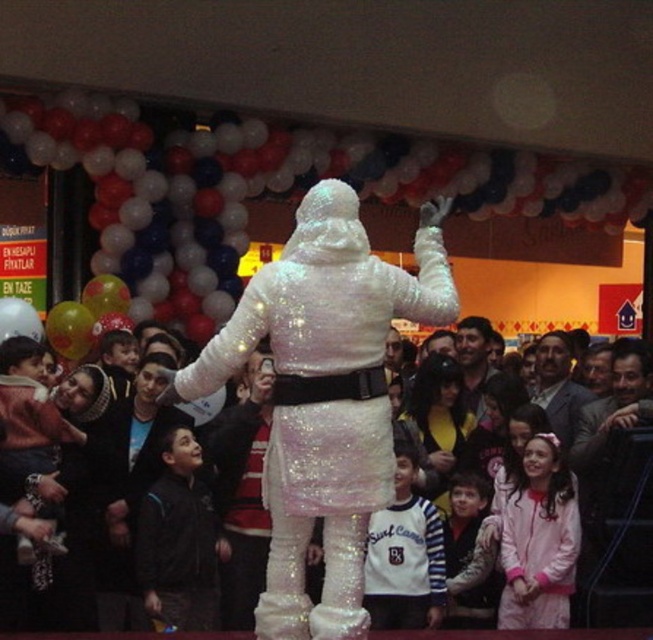
Question: Which of the following is the farthest from the observer?

Choices:
 (A) glittery sequined santa at center
 (B) striped sweater at center
 (C) smooth skin face at center

Answer: (C)

Question: Is striped sweater at center closer to the viewer compared to smooth brown hair at center?

Choices:
 (A) yes
 (B) no

Answer: (A)

Question: Is glittery sequined santa at center behind white sequined jacket at center?

Choices:
 (A) no
 (B) yes

Answer: (A)

Question: Can you confirm if white sequined costume at center is positioned above striped sweater at center?

Choices:
 (A) yes
 (B) no

Answer: (A)

Question: Which point appears farthest from the camera in this image?

Choices:
 (A) (564, 424)
 (B) (383, 602)

Answer: (A)

Question: Among these points, which one is nearest to the camera?

Choices:
 (A) (500, 372)
 (B) (550, 381)
 (C) (214, 282)

Answer: (B)